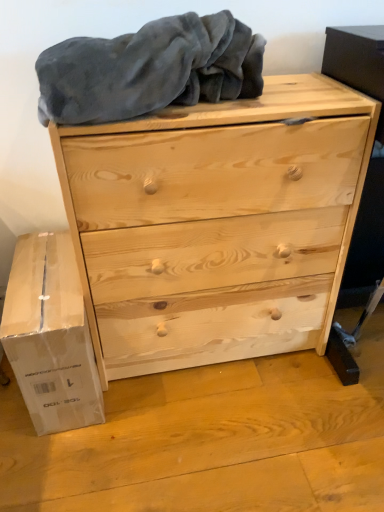
Question: Is the position of gray soft blanket at upper center more distant than that of natural wood chest of drawers at center?

Choices:
 (A) yes
 (B) no

Answer: (B)

Question: Can you confirm if gray soft blanket at upper center is taller than natural wood chest of drawers at center?

Choices:
 (A) no
 (B) yes

Answer: (A)

Question: Is gray soft blanket at upper center facing towards natural wood chest of drawers at center?

Choices:
 (A) yes
 (B) no

Answer: (B)

Question: From the image's perspective, is gray soft blanket at upper center above natural wood chest of drawers at center?

Choices:
 (A) no
 (B) yes

Answer: (B)

Question: Is gray soft blanket at upper center closer to the viewer compared to natural wood chest of drawers at center?

Choices:
 (A) no
 (B) yes

Answer: (B)

Question: Is gray soft blanket at upper center outside of natural wood chest of drawers at center?

Choices:
 (A) yes
 (B) no

Answer: (A)

Question: Can gray soft blanket at upper center be found inside natural wood chest of drawers at center?

Choices:
 (A) no
 (B) yes

Answer: (A)

Question: Does natural wood chest of drawers at center have a larger size compared to gray soft blanket at upper center?

Choices:
 (A) no
 (B) yes

Answer: (B)

Question: From the image's perspective, is natural wood chest of drawers at center beneath gray soft blanket at upper center?

Choices:
 (A) yes
 (B) no

Answer: (A)

Question: Does natural wood chest of drawers at center have a lesser width compared to gray soft blanket at upper center?

Choices:
 (A) no
 (B) yes

Answer: (A)

Question: Considering the relative positions of natural wood chest of drawers at center and gray soft blanket at upper center in the image provided, is natural wood chest of drawers at center to the right of gray soft blanket at upper center from the viewer's perspective?

Choices:
 (A) no
 (B) yes

Answer: (B)

Question: Is natural wood chest of drawers at center to the left of gray soft blanket at upper center from the viewer's perspective?

Choices:
 (A) yes
 (B) no

Answer: (B)

Question: Considering the relative sizes of white cardboard box at lower left and natural wood chest of drawers at center in the image provided, is white cardboard box at lower left smaller than natural wood chest of drawers at center?

Choices:
 (A) yes
 (B) no

Answer: (A)